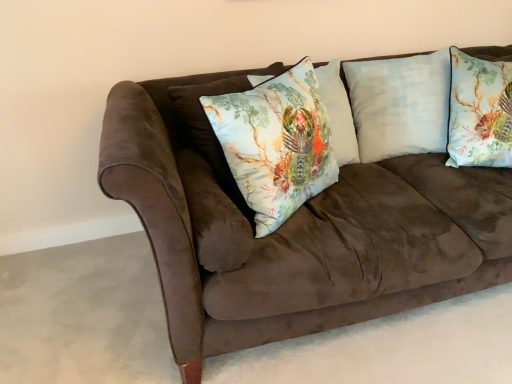
Question: In terms of size, does printed fabric pillow at center, arranged as the 2th pillow when viewed from the left, appear bigger or smaller than textured floral pillow at upper right, the fourth pillow when ordered from left to right?

Choices:
 (A) small
 (B) big

Answer: (B)

Question: Considering the positions of printed fabric pillow at center, the 3th pillow from the right, and textured floral pillow at upper right, the first pillow viewed from the right, in the image, is printed fabric pillow at center, the 3th pillow from the right, taller or shorter than textured floral pillow at upper right, the first pillow viewed from the right,?

Choices:
 (A) short
 (B) tall

Answer: (A)

Question: Estimate the real-world distances between objects in this image. Which object is farther from the printed fabric cushion at center, the 1th pillow from the left?

Choices:
 (A) textured floral pillow at upper right, the first pillow viewed from the right
 (B) suede couch at center
 (C) light blue cotton pillow at upper right, the third pillow from the left
 (D) printed fabric pillow at center, arranged as the 2th pillow when viewed from the left

Answer: (A)

Question: Which of these objects is positioned closest to the textured floral pillow at upper right, the first pillow viewed from the right?

Choices:
 (A) suede couch at center
 (B) printed fabric pillow at center, arranged as the 2th pillow when viewed from the left
 (C) printed fabric cushion at center, the 1th pillow from the left
 (D) light blue cotton pillow at upper right, the third pillow from the left

Answer: (D)